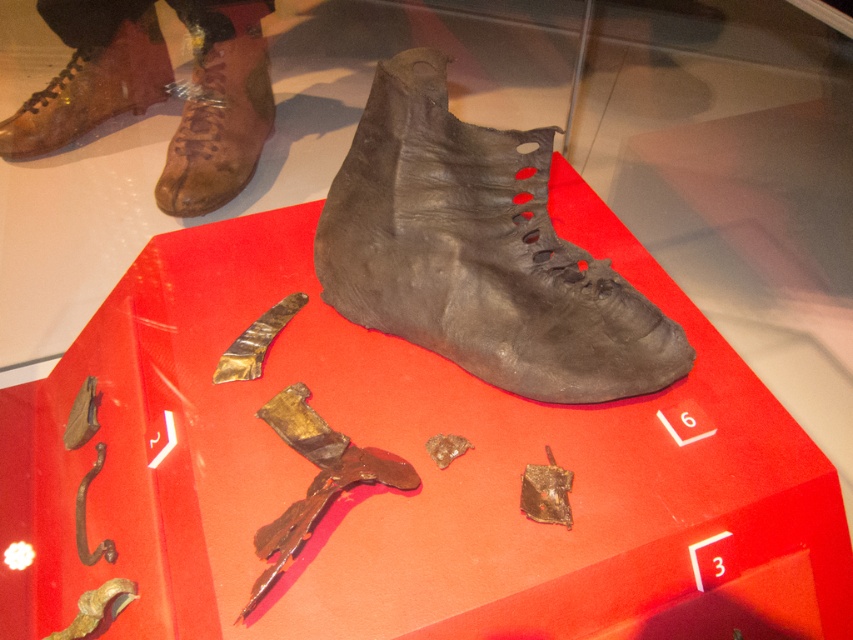
You are a museum curator planning to install a motion sensor to monitor the leather boot at upper left. The sensor has a detection range of 0.2 meters from the center of the display case. Can the sensor detect the boot if it is placed at the center of the case?

The leather boot at upper left is located at point (218, 124). The distance from the center of the display case to this point would need to be calculated. If the display case is considered a coordinate system where the center is at (426, 320), then the distance can be found using the distance formula. The distance squared would be 0.305 squared plus 0.243 squared, totaling approximately 0.093 plus 0.059, which sums to 0.152. The square root of 0.152 is approximately 0.39 meters. Since the sensor has a 0.2m.

Looking at the display case with the matte black boot at center and the leather boot at upper left, which one is bigger in size?

The matte black boot at center has a larger size compared to the leather boot at upper left.